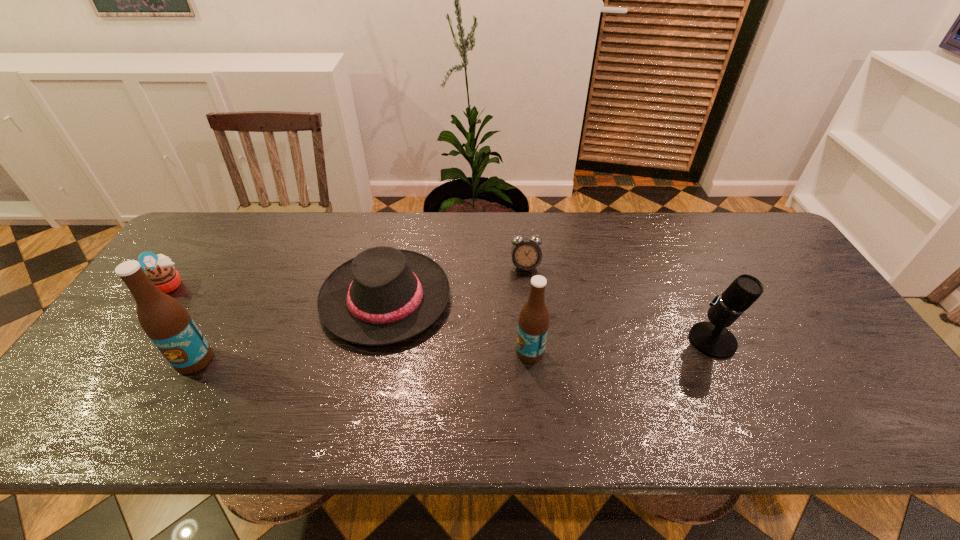
Where is `vacant position in the image that satisfies the following two spatial constraints: 1. on the back side of the taller beer bottle; 2. on the front-facing side of the muffin`? This screenshot has height=540, width=960. vacant position in the image that satisfies the following two spatial constraints: 1. on the back side of the taller beer bottle; 2. on the front-facing side of the muffin is located at coordinates (237, 284).

Where is `vacant space that satisfies the following two spatial constraints: 1. on the face of the alarm clock; 2. on the front-facing side of the muffin`? vacant space that satisfies the following two spatial constraints: 1. on the face of the alarm clock; 2. on the front-facing side of the muffin is located at coordinates (527, 284).

Locate an element on the screen. This screenshot has height=540, width=960. free region that satisfies the following two spatial constraints: 1. on the front-facing side of the shorter beer bottle; 2. on the right side of the leftmost object is located at coordinates (122, 352).